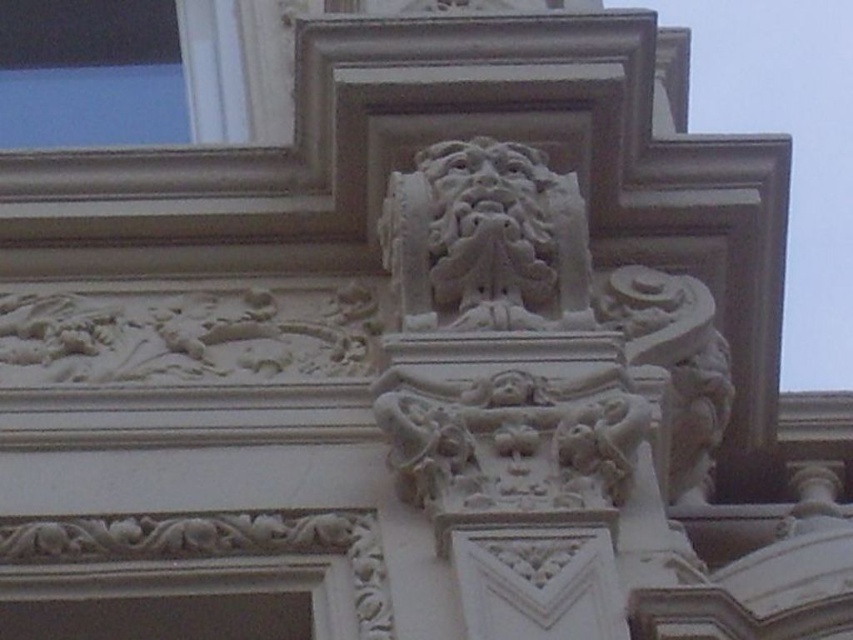
You are an architect inspecting the building facade. You notice the white stone sculpture at center and the transparent glass window at upper left. Which object is positioned higher up on the facade?

The transparent glass window at upper left is positioned higher up on the facade than the white stone sculpture at center.

You are examining the architectural details of the building facade. There are two points marked on the image at coordinates point [505,230] and point [202,70]. If you were to touch both points with your finger, which one would feel closer to your hand?

Point [505,230] is closer to the viewer than point [202,70], so touching it would feel closer to your hand.